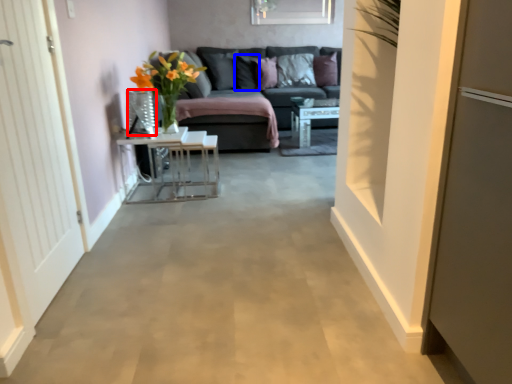
Question: Which object appears closest to the camera in this image, glass vase (highlighted by a red box) or pillow (highlighted by a blue box)?

Choices:
 (A) glass vase
 (B) pillow

Answer: (A)